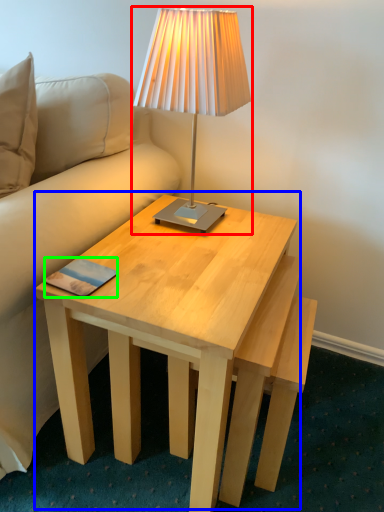
Question: Estimate the real-world distances between objects in this image. Which object is closer to lamp (highlighted by a red box), coffee table (highlighted by a blue box) or pad (highlighted by a green box)?

Choices:
 (A) coffee table
 (B) pad

Answer: (A)